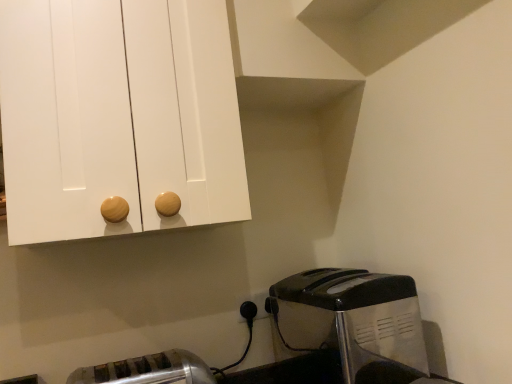
Question: Is satin silver toaster at lower left, which appears as the 2th toaster when viewed from the right, to the left or to the right of metallic silver toaster at lower right, which is the 2th toaster in left-to-right order, in the image?

Choices:
 (A) right
 (B) left

Answer: (B)

Question: From the image's perspective, is satin silver toaster at lower left, placed as the first toaster when sorted from left to right, above or below metallic silver toaster at lower right, the first toaster in the right-to-left sequence?

Choices:
 (A) above
 (B) below

Answer: (B)

Question: Which of these objects is positioned closest to the white plastic electric outlet at lower center?

Choices:
 (A) satin silver toaster at lower left, which appears as the 2th toaster when viewed from the right
 (B) metallic silver toaster at lower right, which is the 2th toaster in left-to-right order

Answer: (B)

Question: Based on their relative distances, which object is nearer to the white plastic electric outlet at lower center?

Choices:
 (A) metallic silver toaster at lower right, which is the 2th toaster in left-to-right order
 (B) satin silver toaster at lower left, which appears as the 2th toaster when viewed from the right

Answer: (A)